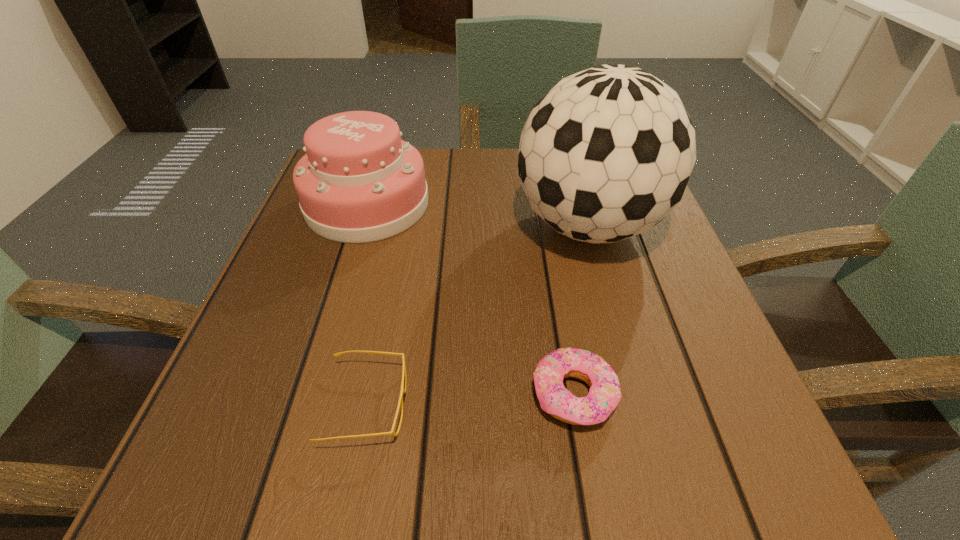
This screenshot has height=540, width=960. Identify the location of doughnut located at the near edge. (604, 394).

Locate an element on the screen. The image size is (960, 540). spectacles at the near edge is located at coordinates (403, 389).

You are a GUI agent. You are given a task and a screenshot of the screen. Output one action in this format:
    pyautogui.click(x=<x>, y=<y>)
    Task: Click on the birthday cake present at the left edge
    This screenshot has width=960, height=540.
    Given the screenshot: What is the action you would take?
    pyautogui.click(x=358, y=182)

Find the location of `spectacles at the left edge`. spectacles at the left edge is located at coordinates (403, 389).

Find the location of a particular element. This screenshot has height=540, width=960. object at the right edge is located at coordinates (606, 154).

This screenshot has height=540, width=960. In order to click on object present at the far left corner in this screenshot , I will do `click(358, 182)`.

Where is `object at the near left corner`? object at the near left corner is located at coordinates (403, 389).

Locate an element on the screen. Image resolution: width=960 pixels, height=540 pixels. object that is at the far right corner is located at coordinates (606, 154).

This screenshot has height=540, width=960. In the image, there is a desktop. Find the location of `free space at the far edge`. free space at the far edge is located at coordinates (447, 207).

What are the coordinates of `blank space at the left edge` in the screenshot? It's located at click(267, 309).